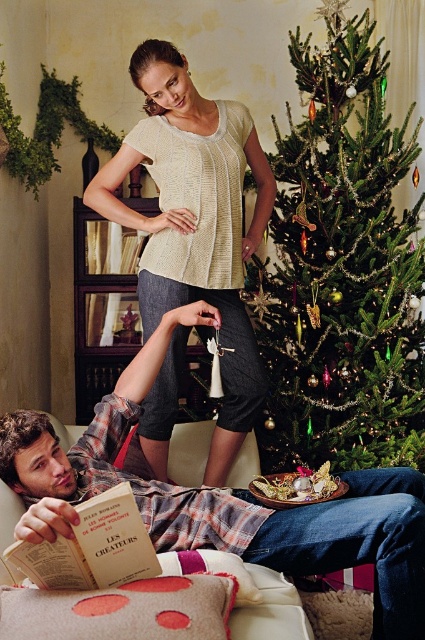
Looking at this image, you are a photographer trying to capture a candid shot of the man reading his book. Since you want to ensure the book is clearly visible in the photo, which object should you focus on first, the plaid fabric shirt at lower left or the hardcover book at lower left?

The plaid fabric shirt at lower left is taller than the hardcover book at lower left, so focusing on the plaid fabric shirt at lower left first would ensure the book is also in frame and visible.

You are standing in the room and want to place a small plant between the two points, point (229, 392) and point (82, 548). Which point should the plant be closer to in order to be closer to the camera?

The plant should be closer to point (229, 392) because it is further to the camera than point (82, 548).

You are a delivery person who needs to place a package between the green textured christmas tree at center and the hardcover book at lower left. The package requires 1.5 meters of space. Can you fit it there?

The green textured christmas tree at center is 1.56 meters from the hardcover book at lower left, so yes, the package requiring 1.5 meters of space can fit between them since the distance is sufficient.